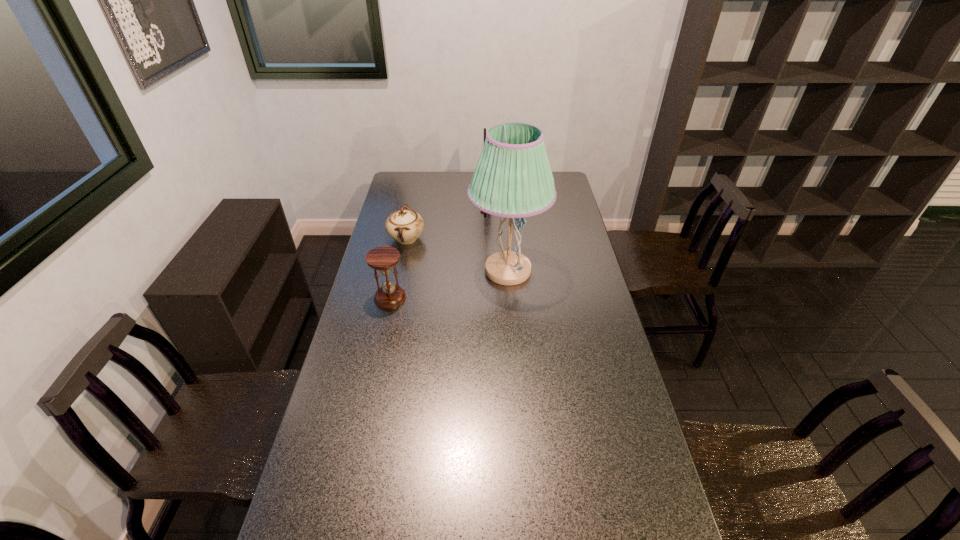
I want to click on object that is at the far edge, so click(485, 214).

The image size is (960, 540). In order to click on hourglass located in the left edge section of the desktop in this screenshot , I will do `click(383, 258)`.

Identify the location of chinaware positioned at the left edge. (405, 225).

The image size is (960, 540). I want to click on vacant space at the left edge of the desktop, so click(x=373, y=307).

Identify the location of free space at the right edge of the desktop. (626, 437).

Locate an element on the screen. The image size is (960, 540). vacant point located between the third tallest object and the tallest object is located at coordinates (449, 284).

This screenshot has height=540, width=960. In order to click on free area in between the third tallest object and the shortest object in this screenshot , I will do `click(398, 268)`.

Locate an element on the screen. This screenshot has height=540, width=960. empty location between the computer monitor and the shortest object is located at coordinates (448, 221).

Where is `the second closest object relative to the third tallest object`? The height and width of the screenshot is (540, 960). the second closest object relative to the third tallest object is located at coordinates (513, 179).

Identify the location of the third closest object to the chinaware. This screenshot has height=540, width=960. (485, 214).